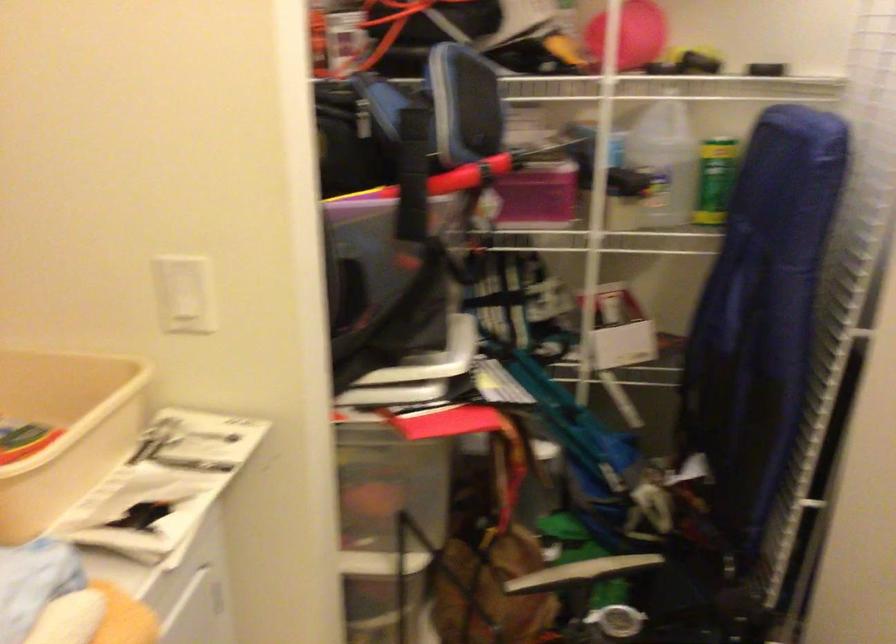
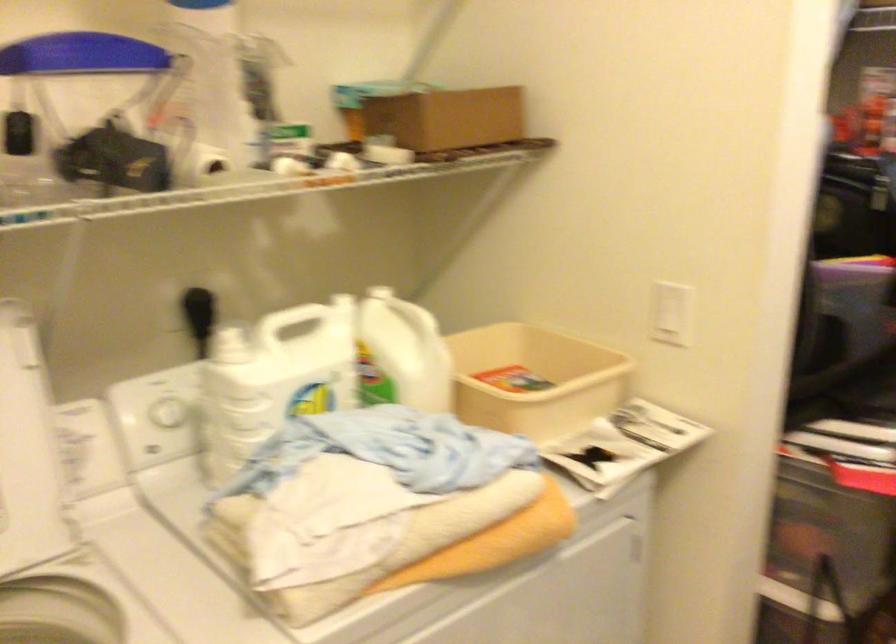
In the second image, find the point that corresponds to (183,292) in the first image.

(670, 313)